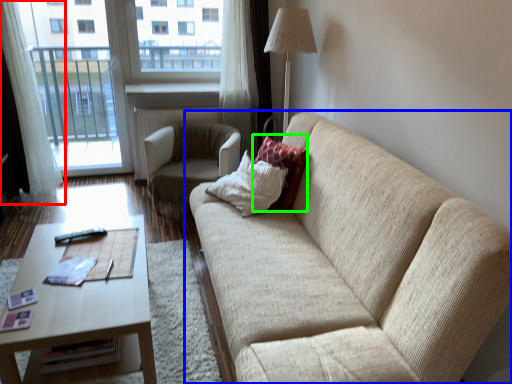
Question: Considering the real-world distances, which object is closest to curtain (highlighted by a red box)? studio couch (highlighted by a blue box) or pillow (highlighted by a green box).

Choices:
 (A) studio couch
 (B) pillow

Answer: (B)